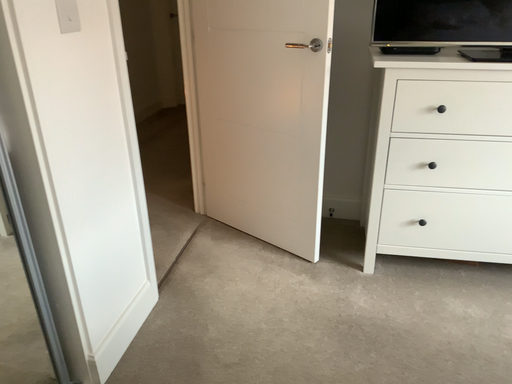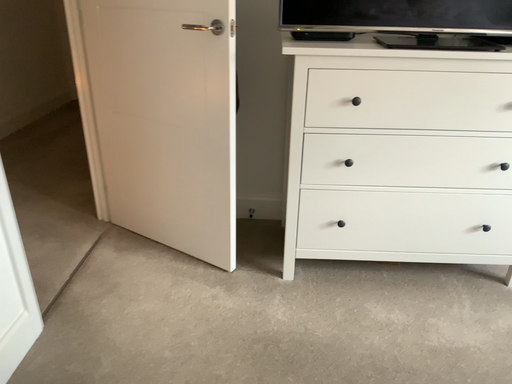
Question: How did the camera likely rotate when shooting the video?

Choices:
 (A) rotated left
 (B) rotated right

Answer: (B)